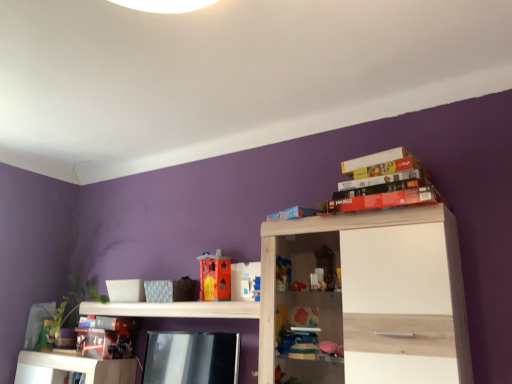
In order to face matte cardboard book at upper right, positioned as the 4th book in bottom-to-top order, should I rotate leftwards or rightwards?

Turn right approximately 17.073 degrees to face it.

The width and height of the screenshot is (512, 384). What do you see at coordinates (45, 337) in the screenshot?
I see `translucent plastic toy at lower left, the 3th toy when ordered from right to left` at bounding box center [45, 337].

What do you see at coordinates (293, 213) in the screenshot?
I see `blue matte bookshelf at upper center, the 4th book positioned from the top` at bounding box center [293, 213].

The height and width of the screenshot is (384, 512). What do you see at coordinates (174, 309) in the screenshot?
I see `white wood shelf at center, positioned as the second shelf in right-to-left order` at bounding box center [174, 309].

Describe the element at coordinates (244, 280) in the screenshot. I see `white plastic toy at center, arranged as the 2th toy when viewed from the top` at that location.

This screenshot has height=384, width=512. What are the coordinates of `metallic silver book at center, which ranks as the 1th book in bottom-to-top order` in the screenshot? It's located at (191, 358).

Image resolution: width=512 pixels, height=384 pixels. What are the coordinates of `matte cardboard book at upper right, the second book from the top` in the screenshot? It's located at (383, 179).

Does translucent plastic toy at lower left, which is counted as the first toy, starting from the back, turn towards matte red lego box at upper right, the 3th book from the top?

No.

Is point (34, 348) closer to viewer compared to point (395, 198)?

No.

Does translucent plastic toy at lower left, the first toy when ordered from bottom to top, come behind matte red lego box at upper right, which is the third book in bottom-to-top order?

Yes.

Is translucent plastic toy at lower left, the first toy when ordered from bottom to top, next to matte red lego box at upper right, which is the third book in bottom-to-top order?

No, translucent plastic toy at lower left, the first toy when ordered from bottom to top, is not next to matte red lego box at upper right, which is the third book in bottom-to-top order.

Choose the correct answer: Is white wood cabinet at upper right, which is counted as the 2th shelf, starting from the back, inside translucent plastic toy at lower left, the third toy in the top-to-bottom sequence, or outside it?

white wood cabinet at upper right, which is counted as the 2th shelf, starting from the back, is located beyond the bounds of translucent plastic toy at lower left, the third toy in the top-to-bottom sequence.

Who is more distant, white wood cabinet at upper right, which ranks as the 2th shelf in left-to-right order, or translucent plastic toy at lower left, which appears as the 3th toy when viewed from the front?

translucent plastic toy at lower left, which appears as the 3th toy when viewed from the front, is further away from the camera.

Is white wood cabinet at upper right, the 1th shelf when ordered from right to left, at the left side of translucent plastic toy at lower left, which is counted as the first toy, starting from the left?

Incorrect, white wood cabinet at upper right, the 1th shelf when ordered from right to left, is not on the left side of translucent plastic toy at lower left, which is counted as the first toy, starting from the left.

Image resolution: width=512 pixels, height=384 pixels. Identify the location of the 1st toy above the translucent plastic toy at lower left, which appears as the 3th toy when viewed from the front (from the image's perspective). (244, 280).

From the image's perspective, who appears lower, white plastic toy at center, positioned as the first toy in front-to-back order, or translucent plastic toy at lower left, the 3th toy when ordered from right to left?

translucent plastic toy at lower left, the 3th toy when ordered from right to left, from the image's perspective.

From a real-world perspective, which object stands above the other?

white plastic toy at center, which appears as the 2th toy when ordered from the bottom, is physically above.

Which point is more forward, (380, 195) or (204, 293)?

The point (380, 195) is in front.

Considering the relative sizes of matte red lego box at upper right, which is the third book in bottom-to-top order, and plastic toy castle at center, which is counted as the 3th toy, starting from the bottom, in the image provided, is matte red lego box at upper right, which is the third book in bottom-to-top order, taller than plastic toy castle at center, which is counted as the 3th toy, starting from the bottom,?

Incorrect, the height of matte red lego box at upper right, which is the third book in bottom-to-top order, is not larger of that of plastic toy castle at center, which is counted as the 3th toy, starting from the bottom.

From a real-world perspective, relative to plastic toy castle at center, which appears as the second toy when viewed from the back, is matte red lego box at upper right, which is the third book in bottom-to-top order, vertically above or below?

matte red lego box at upper right, which is the third book in bottom-to-top order, is above plastic toy castle at center, which appears as the second toy when viewed from the back.

Is matte red lego box at upper right, which is the third book in bottom-to-top order, facing towards plastic toy castle at center, which appears as the second toy when viewed from the back?

No, matte red lego box at upper right, which is the third book in bottom-to-top order, is not facing towards plastic toy castle at center, which appears as the second toy when viewed from the back.

Is metallic silver book at center, which ranks as the 1th book in bottom-to-top order, in front of or behind white wood cabinet at upper right, which is counted as the 2th shelf, starting from the back, in the image?

metallic silver book at center, which ranks as the 1th book in bottom-to-top order, is positioned farther from the viewer than white wood cabinet at upper right, which is counted as the 2th shelf, starting from the back.

Considering the relative sizes of metallic silver book at center, the fifth book positioned from the top, and white wood cabinet at upper right, the 1th shelf when ordered from right to left, in the image provided, is metallic silver book at center, the fifth book positioned from the top, wider than white wood cabinet at upper right, the 1th shelf when ordered from right to left,?

In fact, metallic silver book at center, the fifth book positioned from the top, might be narrower than white wood cabinet at upper right, the 1th shelf when ordered from right to left.

Which is more to the right, metallic silver book at center, which ranks as the 1th book in bottom-to-top order, or white wood cabinet at upper right, which is counted as the 2th shelf, starting from the back?

white wood cabinet at upper right, which is counted as the 2th shelf, starting from the back, is more to the right.

Are metallic silver book at center, the fifth book positioned from the top, and white wood cabinet at upper right, which ranks as the 2th shelf in left-to-right order, far apart?

Actually, metallic silver book at center, the fifth book positioned from the top, and white wood cabinet at upper right, which ranks as the 2th shelf in left-to-right order, are a little close together.

Is white plastic toy at center, which ranks as the 1th toy in right-to-left order, facing towards white wood cabinet at upper right, which is counted as the 2th shelf, starting from the back?

No, white plastic toy at center, which ranks as the 1th toy in right-to-left order, is not aimed at white wood cabinet at upper right, which is counted as the 2th shelf, starting from the back.

From the image's perspective, which one is positioned lower, white plastic toy at center, positioned as the first toy in front-to-back order, or white wood cabinet at upper right, the 1th shelf when ordered from right to left?

white wood cabinet at upper right, the 1th shelf when ordered from right to left, from the image's perspective.

Is white plastic toy at center, positioned as the first toy in front-to-back order, inside or outside of white wood cabinet at upper right, which is the first shelf from front to back?

white plastic toy at center, positioned as the first toy in front-to-back order, is not enclosed by white wood cabinet at upper right, which is the first shelf from front to back.

From a real-world perspective, which object rests below the other?

From a 3D spatial view, white wood cabinet at upper right, which is the first shelf from front to back, is below.

Between point (151, 313) and point (210, 340), which one is positioned in front?

The point (210, 340) is more forward.

Can you tell me how much white wood shelf at center, the second shelf positioned from the front, and metallic silver book at center, which ranks as the 1th book in bottom-to-top order, differ in facing direction?

The facing directions of white wood shelf at center, the second shelf positioned from the front, and metallic silver book at center, which ranks as the 1th book in bottom-to-top order, are 0.83 degrees apart.

Is white wood shelf at center, which ranks as the 1th shelf in left-to-right order, touching metallic silver book at center, which ranks as the 1th book in bottom-to-top order?

white wood shelf at center, which ranks as the 1th shelf in left-to-right order, and metallic silver book at center, which ranks as the 1th book in bottom-to-top order, are not in contact.

From the image's perspective, which is below, white wood shelf at center, the first shelf from the back, or metallic silver book at center, the fifth book positioned from the top?

metallic silver book at center, the fifth book positioned from the top, appears lower in the image.

Identify the location of book that is the 5th one when counting forward from the translucent plastic toy at lower left, the third toy in the top-to-bottom sequence. (386, 199).

At what (x,y) coordinates should I click in order to perform the action: click on the 2nd shelf positioned above the translucent plastic toy at lower left, the first toy when ordered from bottom to top (from the image's perspective). Please return your answer as a coordinate pair (x, y). This screenshot has height=384, width=512. Looking at the image, I should click on (375, 296).

Which object lies nearer to the anchor point white wood cabinet at upper right, which is counted as the 2th shelf, starting from the back, metallic silver book at center, which ranks as the 1th book in bottom-to-top order, or plastic toy castle at center, which appears as the second toy when viewed from the back?

metallic silver book at center, which ranks as the 1th book in bottom-to-top order, lies closer to white wood cabinet at upper right, which is counted as the 2th shelf, starting from the back, than the other object.

Estimate the real-world distances between objects in this image. Which object is closer to plastic toy castle at center, which ranks as the 2th toy in left-to-right order, metallic silver book at center, the fifth book positioned from the top, or blue matte bookshelf at upper center, which appears as the 2th book when ordered from the bottom?

metallic silver book at center, the fifth book positioned from the top, is positioned closer to the anchor plastic toy castle at center, which ranks as the 2th toy in left-to-right order.

When comparing their distances from matte red lego box at upper right, which is the third book in bottom-to-top order, does matte cardboard book at upper right, the second book from the top, or white wood shelf at center, positioned as the second shelf in right-to-left order, seem closer?

matte cardboard book at upper right, the second book from the top, lies closer to matte red lego box at upper right, which is the third book in bottom-to-top order, than the other object.

Which object lies further to the anchor point white wood shelf at center, which ranks as the 1th shelf in left-to-right order, metallic silver book at center, the fifth book positioned from the top, or matte cardboard book at upper right, which ranks as the fifth book in bottom-to-top order?

matte cardboard book at upper right, which ranks as the fifth book in bottom-to-top order, is further to white wood shelf at center, which ranks as the 1th shelf in left-to-right order.

Based on the photo, when comparing their distances from blue matte bookshelf at upper center, the 4th book positioned from the top, does matte cardboard book at upper right, the second book from the top, or metallic silver book at center, the fifth book positioned from the top, seem further?

metallic silver book at center, the fifth book positioned from the top, is positioned further to the anchor blue matte bookshelf at upper center, the 4th book positioned from the top.

From the image, which object appears to be farther from white wood shelf at center, the second shelf positioned from the front, plastic toy castle at center, which is counted as the second toy, starting from the right, or matte cardboard book at upper right, which ranks as the fifth book in bottom-to-top order?

Among the two, matte cardboard book at upper right, which ranks as the fifth book in bottom-to-top order, is located further to white wood shelf at center, the second shelf positioned from the front.

From the image, which object appears to be nearer to matte red lego box at upper right, the 3th book from the top, white plastic toy at center, arranged as the 2th toy when viewed from the top, or white wood cabinet at upper right, which is the first shelf from front to back?

white wood cabinet at upper right, which is the first shelf from front to back, is positioned closer to the anchor matte red lego box at upper right, the 3th book from the top.

From the image, which object appears to be farther from matte red lego box at upper right, the 3th book from the top, plastic toy castle at center, which is counted as the 1th toy, starting from the top, or matte cardboard book at upper right, which is the 1th book from top to bottom?

plastic toy castle at center, which is counted as the 1th toy, starting from the top, is further to matte red lego box at upper right, the 3th book from the top.

Find the location of a particular element. This screenshot has width=512, height=384. shelf between translucent plastic toy at lower left, which appears as the 3th toy when viewed from the front, and plastic toy castle at center, which appears as the second toy when viewed from the back is located at coordinates (174, 309).

Locate an element on the screen. shelf between metallic silver book at center, which ranks as the 1th book in bottom-to-top order, and matte cardboard book at upper right, positioned as the 4th book in bottom-to-top order, from left to right is located at coordinates (375, 296).

Identify the location of shelf located between metallic silver book at center, which ranks as the 1th book in bottom-to-top order, and matte red lego box at upper right, the 3th book from the top, in the left-right direction. (375, 296).

Image resolution: width=512 pixels, height=384 pixels. I want to click on shelf between translucent plastic toy at lower left, which is counted as the first toy, starting from the left, and blue matte bookshelf at upper center, which appears as the 2th book when ordered from the bottom, from left to right, so click(174, 309).